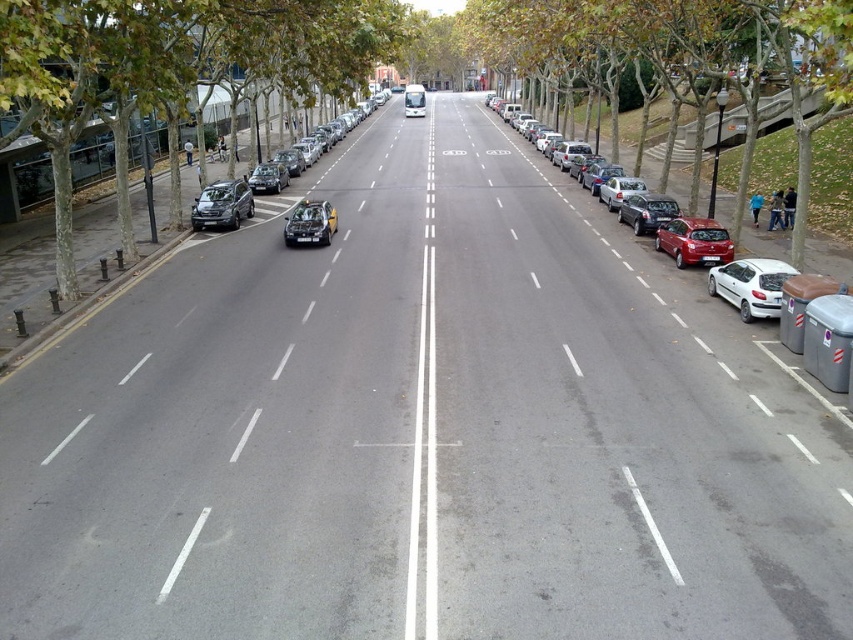
Question: Is white matte hatchback at right above satin black car at center?

Choices:
 (A) yes
 (B) no

Answer: (B)

Question: Which of the following is the farthest from the observer?

Choices:
 (A) (486, 120)
 (B) (701, 259)
 (C) (688, 237)

Answer: (A)

Question: Among these objects, which one is farthest from the camera?

Choices:
 (A) satin black car at center
 (B) white matte hatchback at right
 (C) green leafy tree at left
 (D) shiny red car at right

Answer: (A)

Question: Which object is farther from the camera taking this photo?

Choices:
 (A) satin black car at center
 (B) green leafy tree at left
 (C) white asphalt road at center

Answer: (A)

Question: Can you confirm if shiny silver car at center is smaller than white smooth line at center?

Choices:
 (A) yes
 (B) no

Answer: (B)

Question: Considering the relative positions of white matte hatchback at right and satin black car at center in the image provided, where is white matte hatchback at right located with respect to satin black car at center?

Choices:
 (A) right
 (B) left

Answer: (A)